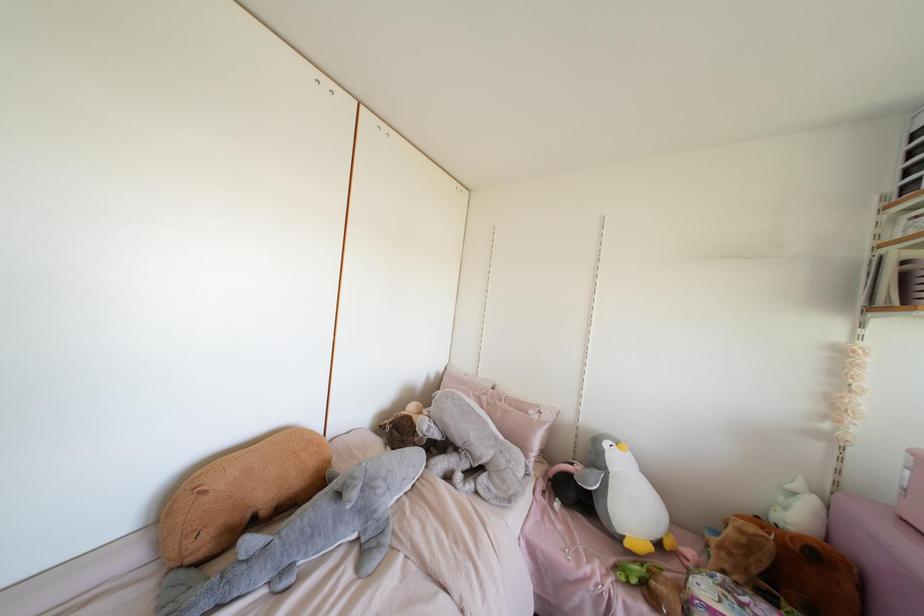
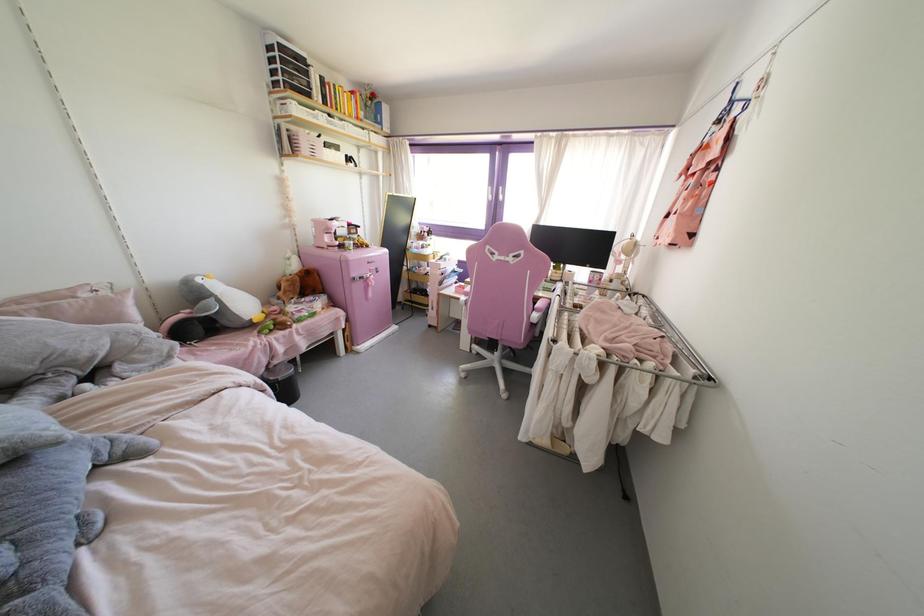
The point at (530, 411) is marked in the first image. Where is the corresponding point in the second image?

(83, 294)